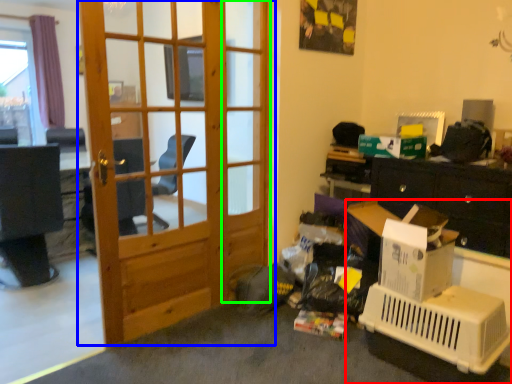
Question: Considering the real-world distances, which object is farthest from desk (highlighted by a red box)? door (highlighted by a blue box) or screen door (highlighted by a green box)?

Choices:
 (A) door
 (B) screen door

Answer: (A)